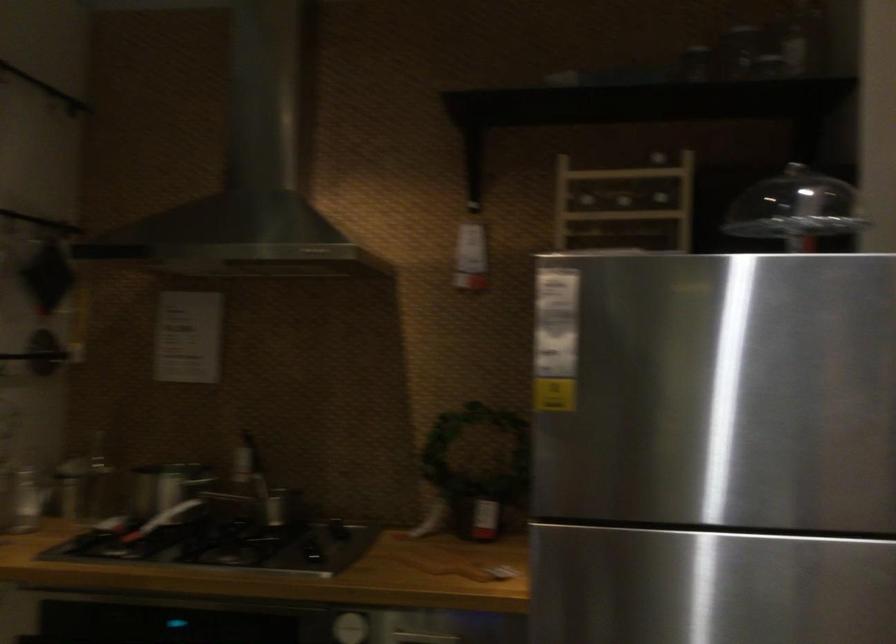
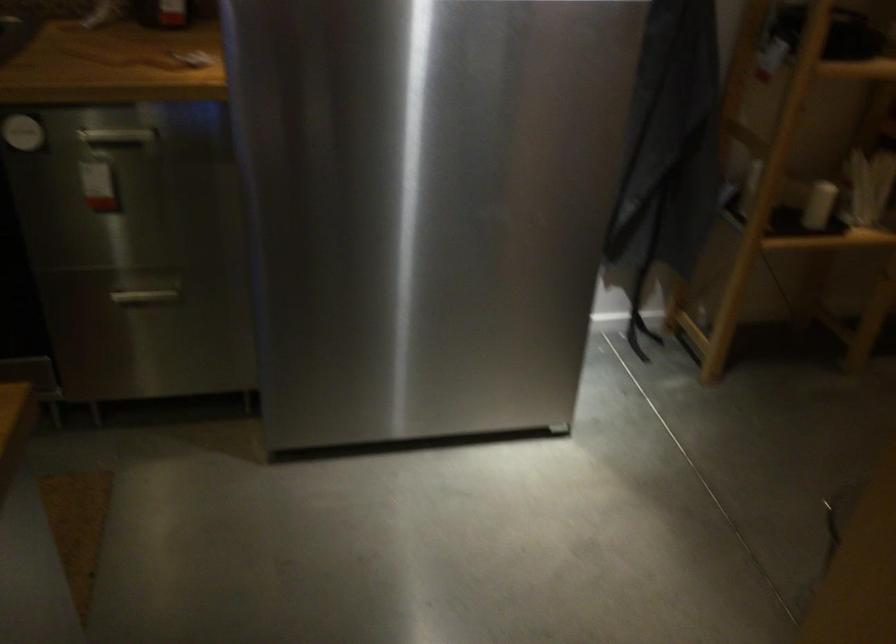
First-person continuous shooting, in which direction is the camera rotating?

The rotation direction of the camera is right-down.